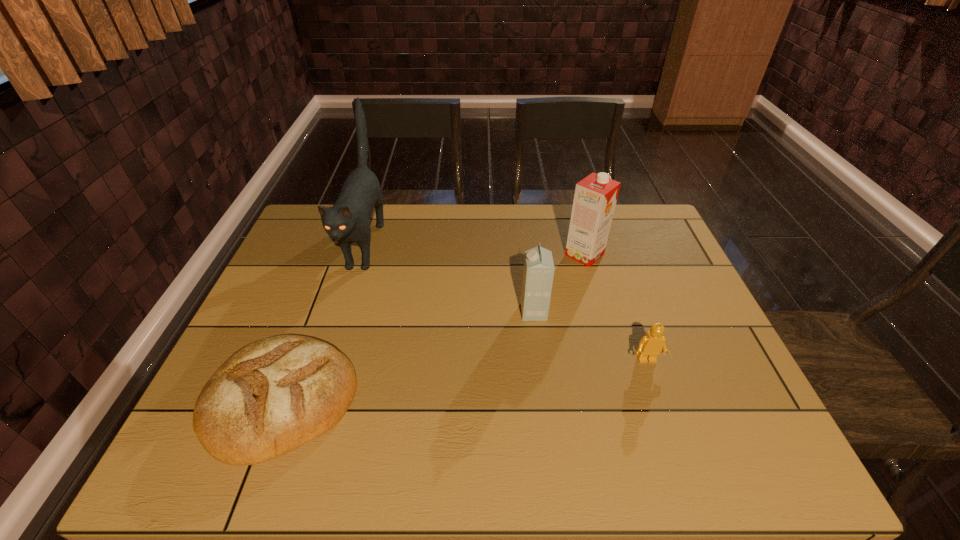
You are a GUI agent. You are given a task and a screenshot of the screen. Output one action in this format:
    pyautogui.click(x=<x>, y=<y>)
    Task: Click on the free space located 0.280m on the front label of the third nearest object
    This screenshot has height=540, width=960.
    Given the screenshot: What is the action you would take?
    pyautogui.click(x=416, y=312)

The image size is (960, 540). In order to click on vacant space located 0.090m on the front label of the third nearest object in this screenshot , I will do `click(488, 312)`.

You are a GUI agent. You are given a task and a screenshot of the screen. Output one action in this format:
    pyautogui.click(x=<x>, y=<y>)
    Task: Click on the vacant area situated on the face of the second shortest object
    This screenshot has height=540, width=960.
    Given the screenshot: What is the action you would take?
    pyautogui.click(x=657, y=390)

Find the location of a particular element. The height and width of the screenshot is (540, 960). free region located on the right of the bread is located at coordinates (483, 400).

The image size is (960, 540). What are the coordinates of `cat at the far edge` in the screenshot? It's located at (348, 220).

Where is `carton positioned at the far edge`? This screenshot has width=960, height=540. carton positioned at the far edge is located at coordinates (595, 197).

Find the location of a particular element. The width and height of the screenshot is (960, 540). object that is at the near edge is located at coordinates (273, 395).

Where is `object that is at the left edge`? The height and width of the screenshot is (540, 960). object that is at the left edge is located at coordinates pyautogui.click(x=273, y=395).

At what (x,y) coordinates should I click in order to perform the action: click on object that is at the right edge. Please return your answer as a coordinate pair (x, y). This screenshot has width=960, height=540. Looking at the image, I should click on (650, 346).

Where is `object situated at the near left corner`? This screenshot has width=960, height=540. object situated at the near left corner is located at coordinates (273, 395).